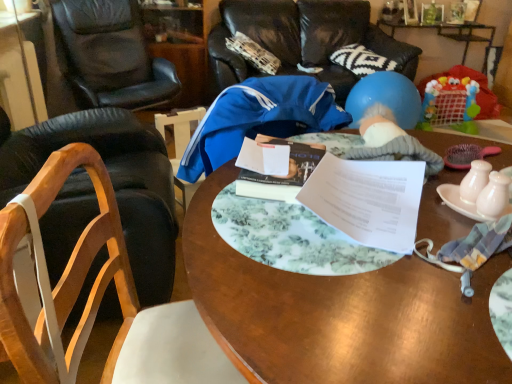
This screenshot has width=512, height=384. I want to click on free space to the left of pink ceramic plate at right, so click(x=410, y=222).